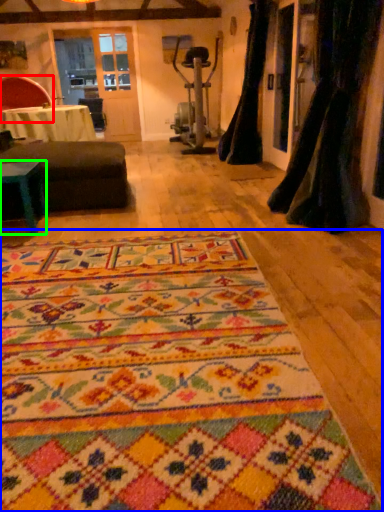
Question: Considering the real-world distances, which object is closest to chair (highlighted by a red box)? mat (highlighted by a blue box) or table (highlighted by a green box).

Choices:
 (A) mat
 (B) table

Answer: (B)